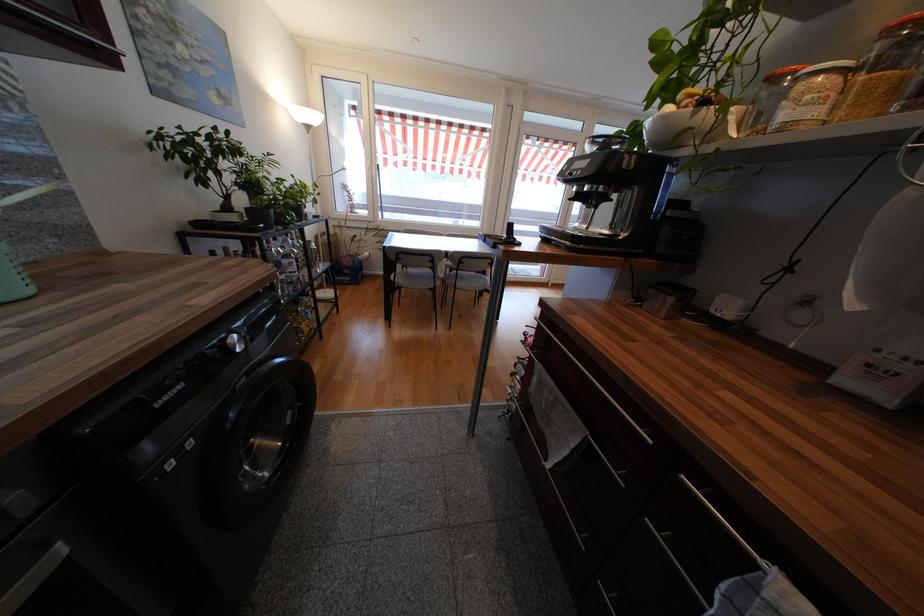
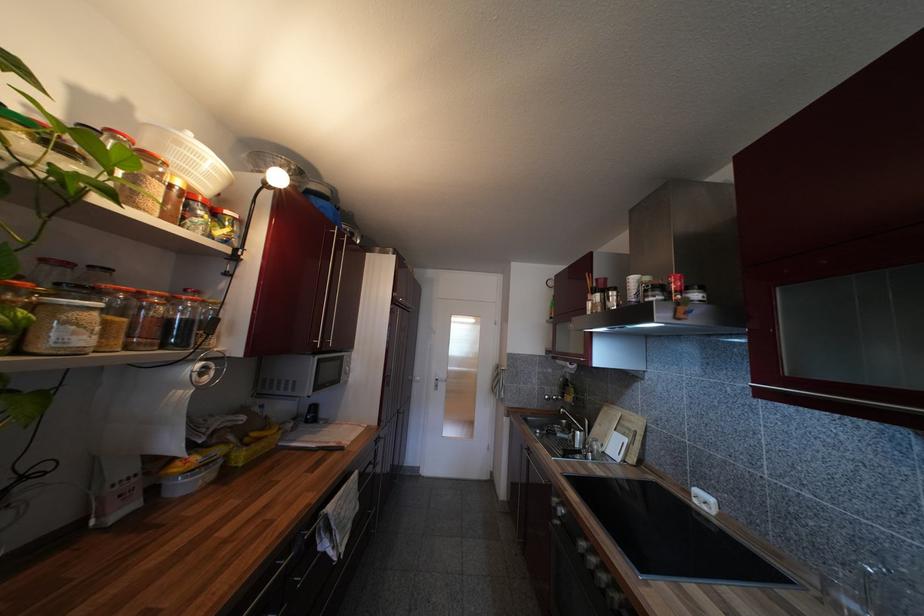
Locate, in the second image, the point that corresponds to (x=873, y=368) in the first image.

(124, 498)